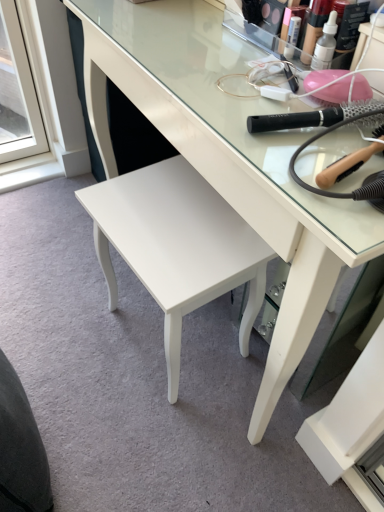
Where is `free space in front of black plastic hairbrush at upper right, which is counted as the first brush, starting from the top`? This screenshot has height=512, width=384. free space in front of black plastic hairbrush at upper right, which is counted as the first brush, starting from the top is located at coordinates (314, 174).